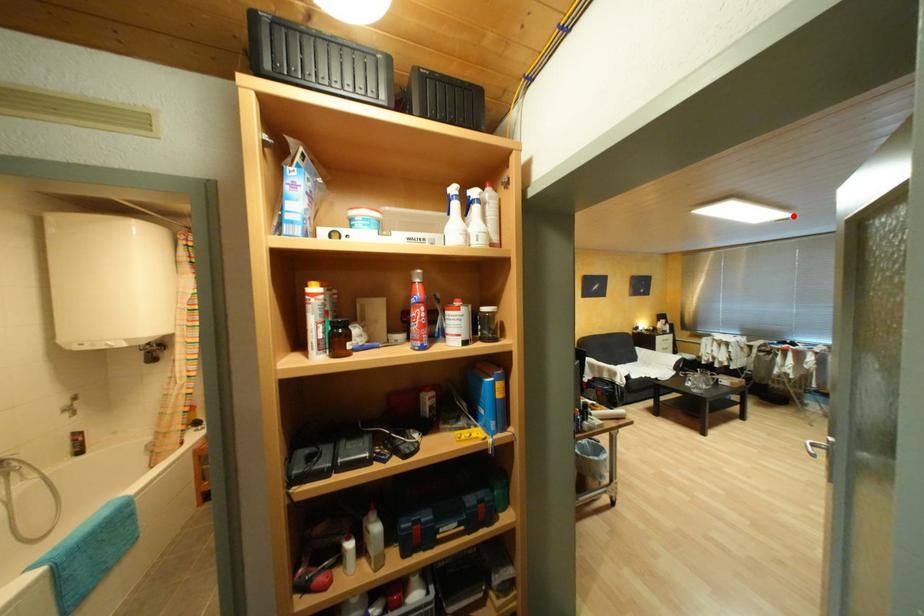
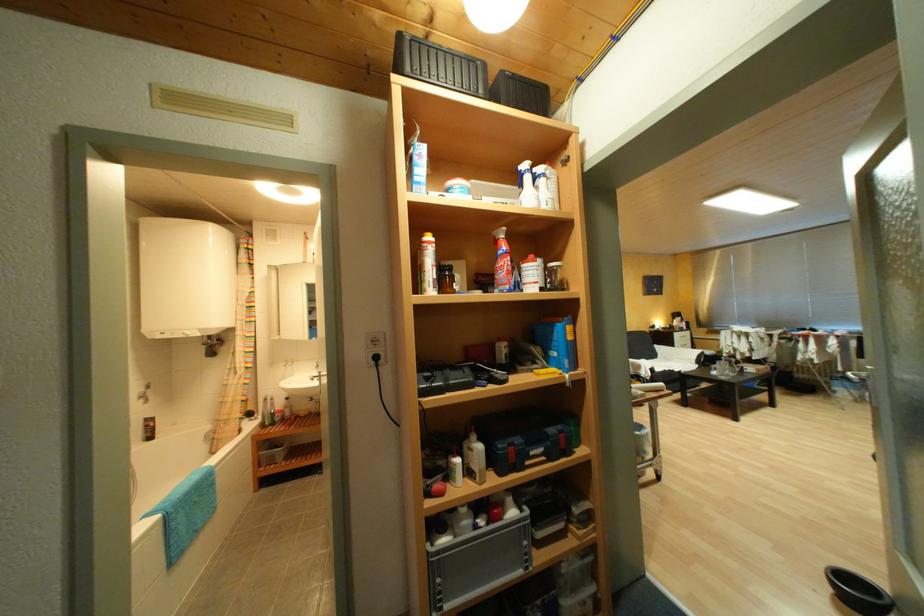
Locate, in the second image, the point that corresponds to the highlighted location in the first image.

(798, 206)